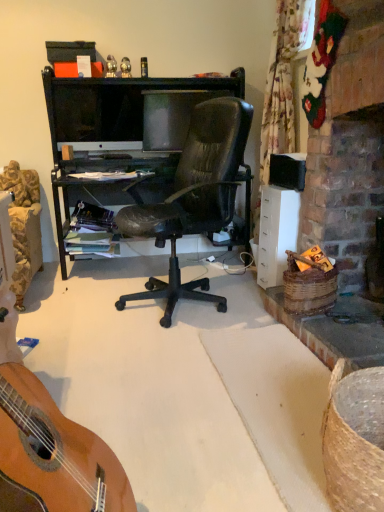
Question: From the image's perspective, is matte black box at upper center located above matte black monitor at center, which is the second television in left-to-right order?

Choices:
 (A) no
 (B) yes

Answer: (B)

Question: Is matte black box at upper center thinner than matte black monitor at center, which is the second television in left-to-right order?

Choices:
 (A) yes
 (B) no

Answer: (B)

Question: Can you confirm if matte black box at upper center is wider than matte black monitor at center, which is the second television in left-to-right order?

Choices:
 (A) no
 (B) yes

Answer: (B)

Question: Does matte black box at upper center appear on the left side of matte black monitor at center, marked as the first television in a right-to-left arrangement?

Choices:
 (A) yes
 (B) no

Answer: (A)

Question: Can you see matte black box at upper center touching matte black monitor at center, which is the second television in left-to-right order?

Choices:
 (A) no
 (B) yes

Answer: (A)

Question: Is point (92, 47) positioned closer to the camera than point (352, 458)?

Choices:
 (A) closer
 (B) farther

Answer: (B)

Question: Based on their positions, is matte black box at upper center located to the left or right of brown woven picnic basket at lower right, which ranks as the 2th picnic basket in back-to-front order?

Choices:
 (A) left
 (B) right

Answer: (A)

Question: Do you think matte black box at upper center is within brown woven picnic basket at lower right, which ranks as the 2th picnic basket in back-to-front order, or outside of it?

Choices:
 (A) outside
 (B) inside

Answer: (A)

Question: From a real-world perspective, is matte black box at upper center physically located above or below brown woven picnic basket at lower right, which is the 2th picnic basket in top-to-bottom order?

Choices:
 (A) above
 (B) below

Answer: (A)

Question: Looking at their shapes, would you say matte black box at upper center is wider or thinner than matte black monitor at center, marked as the 1th television in a left-to-right arrangement?

Choices:
 (A) thin
 (B) wide

Answer: (B)

Question: Considering their positions, is matte black box at upper center located in front of or behind matte black monitor at center, marked as the 1th television in a left-to-right arrangement?

Choices:
 (A) front
 (B) behind

Answer: (A)

Question: From the image's perspective, is matte black box at upper center positioned above or below matte black monitor at center, which is counted as the 2th television, starting from the right?

Choices:
 (A) below
 (B) above

Answer: (B)

Question: Considering the positions of matte black box at upper center and matte black monitor at center, which is counted as the 2th television, starting from the right, in the image, is matte black box at upper center bigger or smaller than matte black monitor at center, which is counted as the 2th television, starting from the right,?

Choices:
 (A) small
 (B) big

Answer: (A)

Question: Is brown woven picnic basket at right, the first picnic basket when ordered from top to bottom, to the left or to the right of matte black monitor at center, which is the second television in left-to-right order, in the image?

Choices:
 (A) right
 (B) left

Answer: (A)

Question: From their relative heights in the image, would you say brown woven picnic basket at right, the first picnic basket when ordered from top to bottom, is taller or shorter than matte black monitor at center, which is the second television in left-to-right order?

Choices:
 (A) tall
 (B) short

Answer: (B)